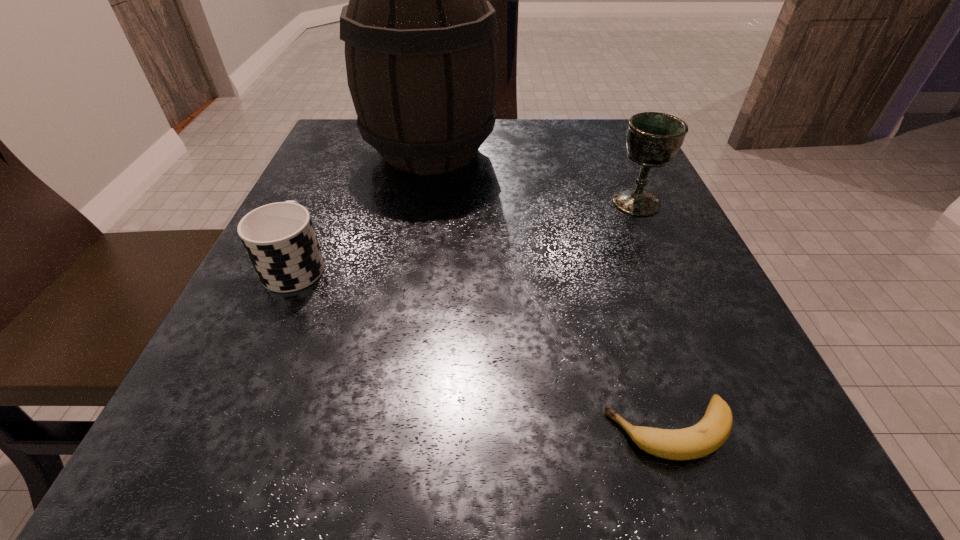
Find the location of a particular element. This screenshot has width=960, height=540. free space between the wine bucket and the third shortest object is located at coordinates (533, 177).

Where is `vacant area between the wine bucket and the third nearest object`? vacant area between the wine bucket and the third nearest object is located at coordinates (533, 177).

Locate an element on the screen. The height and width of the screenshot is (540, 960). free space between the wine bucket and the chalice is located at coordinates (533, 177).

What are the coordinates of `free space between the shortest object and the second shortest object` in the screenshot? It's located at (483, 348).

Locate an element on the screen. The width and height of the screenshot is (960, 540). vacant region between the tallest object and the cup is located at coordinates (363, 208).

The image size is (960, 540). In order to click on unoccupied position between the second tallest object and the shortest object in this screenshot , I will do `click(653, 316)`.

Identify the location of empty location between the shortest object and the tallest object. (550, 291).

Locate an element on the screen. empty space that is in between the farthest object and the banana is located at coordinates (550, 291).

Locate an element on the screen. The width and height of the screenshot is (960, 540). free space between the nearest object and the cup is located at coordinates (483, 348).

Identify which object is the second nearest to the third farthest object. Please provide its 2D coordinates. Your answer should be formatted as a tuple, i.e. [(x, y)], where the tuple contains the x and y coordinates of a point satisfying the conditions above.

[(710, 433)]